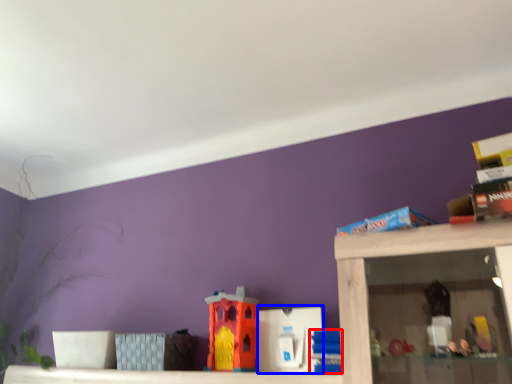
Question: Which point is closer to the camera, toy (highlighted by a red box) or toy (highlighted by a blue box)?

Choices:
 (A) toy
 (B) toy

Answer: (A)